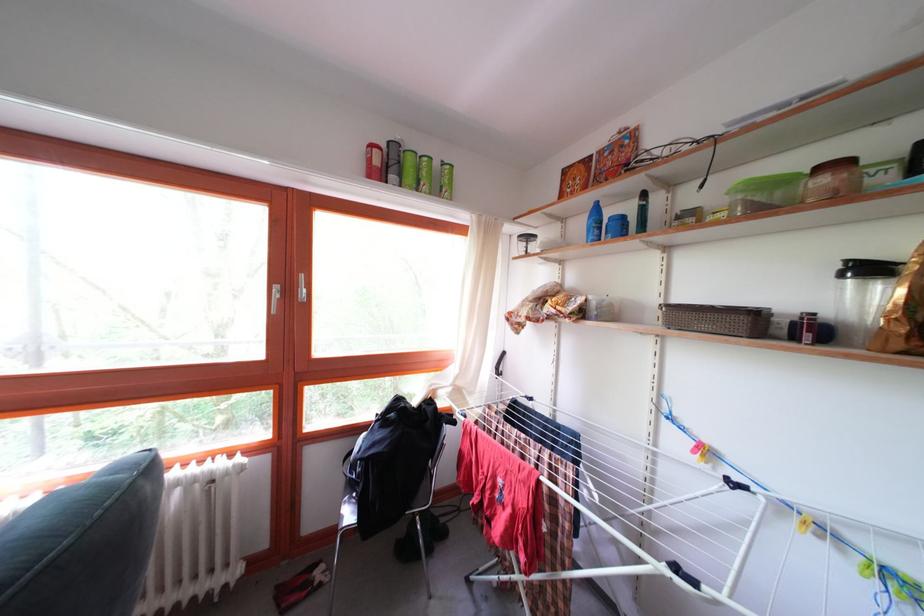
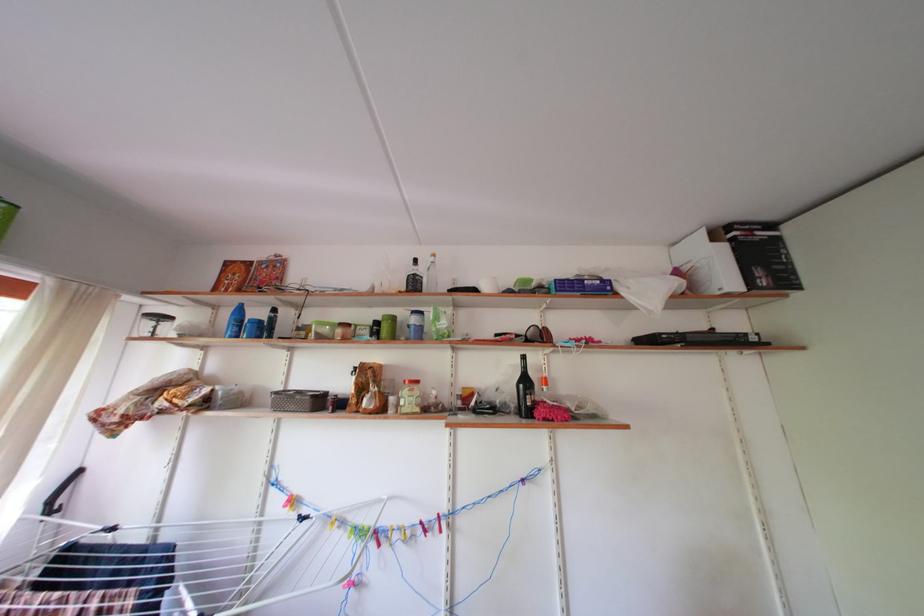
Where in the second image is the point corresponding to (x=598, y=204) from the first image?

(242, 305)